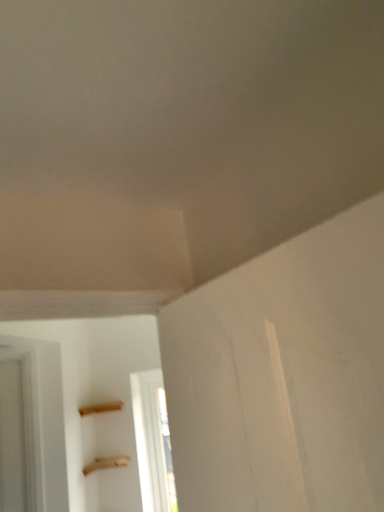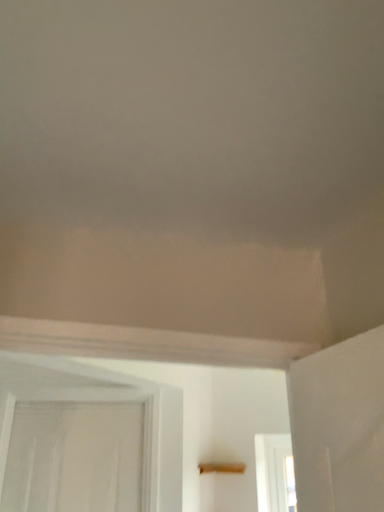
Question: Which way did the camera rotate in the video?

Choices:
 (A) rotated right
 (B) rotated left

Answer: (B)